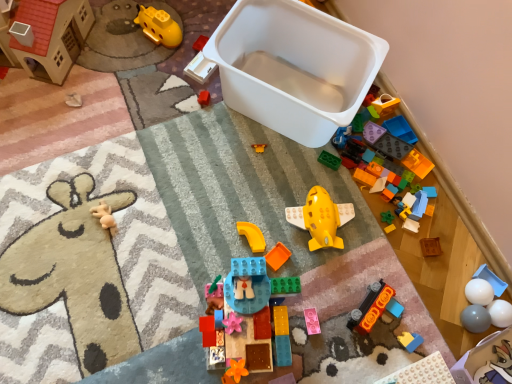
At what (x,y) coordinates should I click in order to perform the action: click on free location to the left of orange matte block at center, acting as the 6th toy starting from the left. Please return your answer as a coordinate pair (x, y). Image resolution: width=512 pixels, height=384 pixels. Looking at the image, I should click on (211, 247).